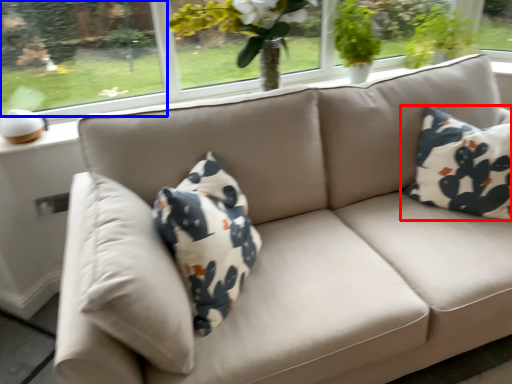
Question: Among these objects, which one is farthest to the camera, pillow (highlighted by a red box) or window screen (highlighted by a blue box)?

Choices:
 (A) pillow
 (B) window screen

Answer: (B)